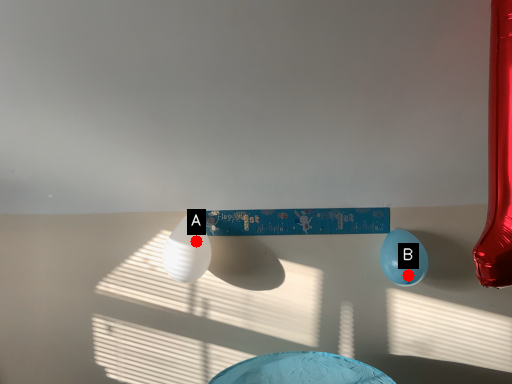
Question: Two points are circled on the image, labeled by A and B beside each circle. Among these points, which one is nearest to the camera?

Choices:
 (A) A is closer
 (B) B is closer

Answer: (B)